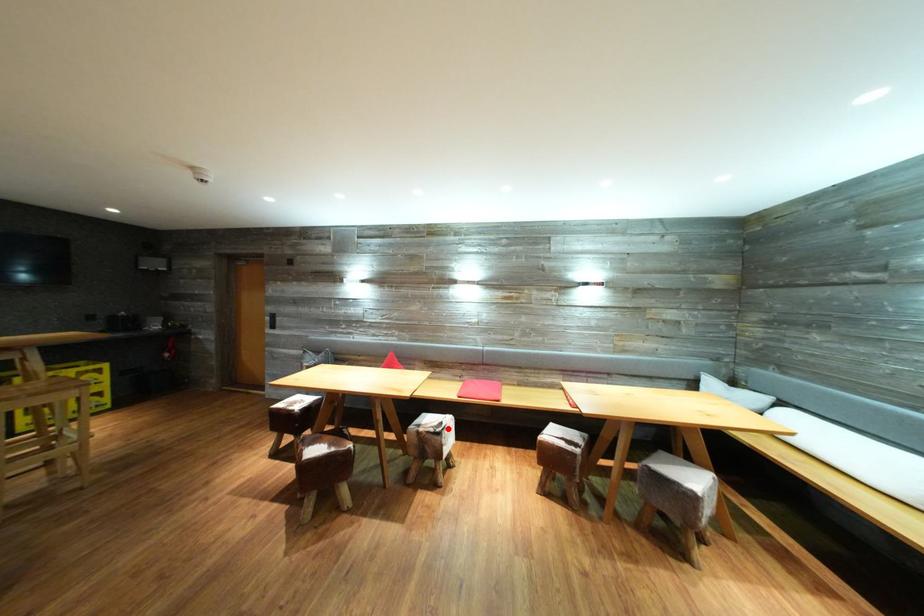
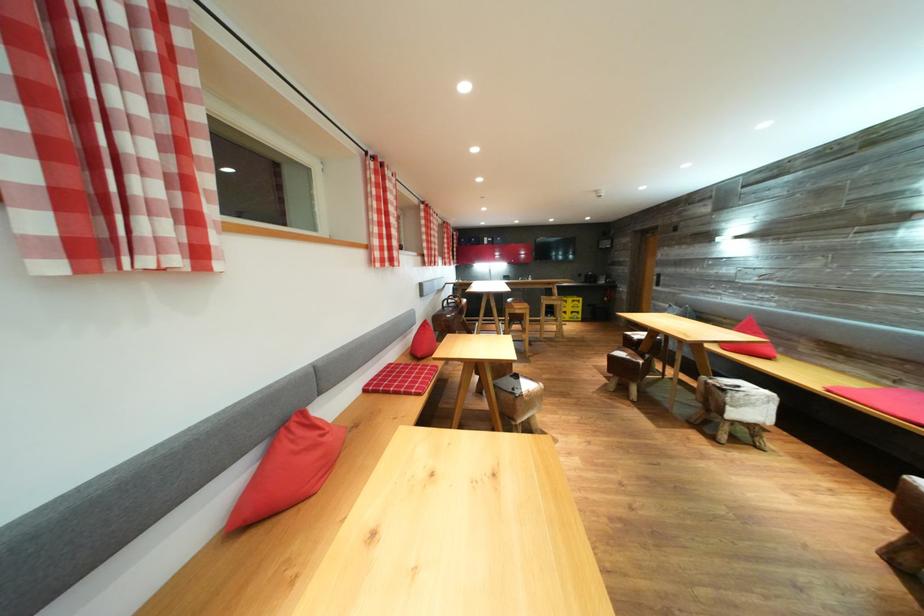
Where in the second image is the point corresponding to the highlighted location from the first image?

(745, 392)